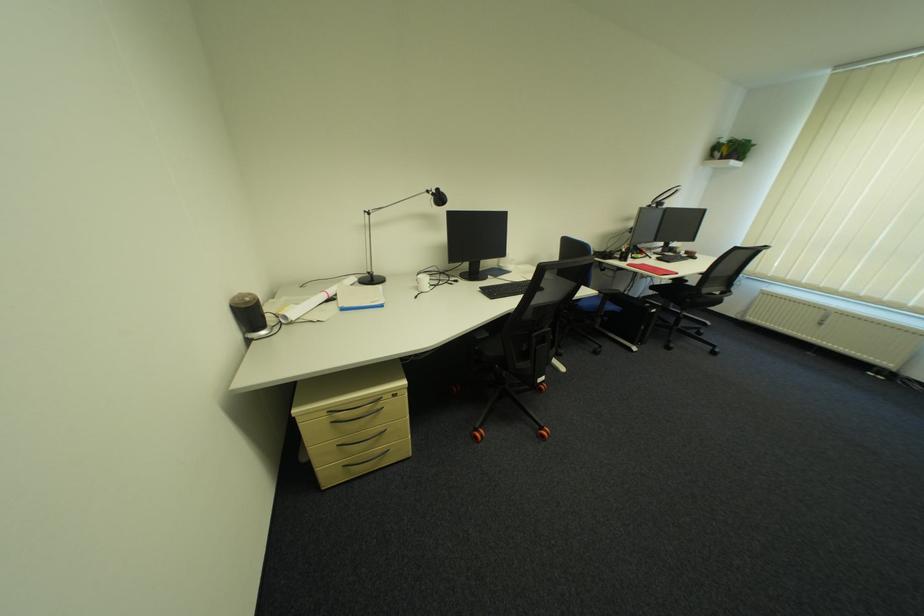
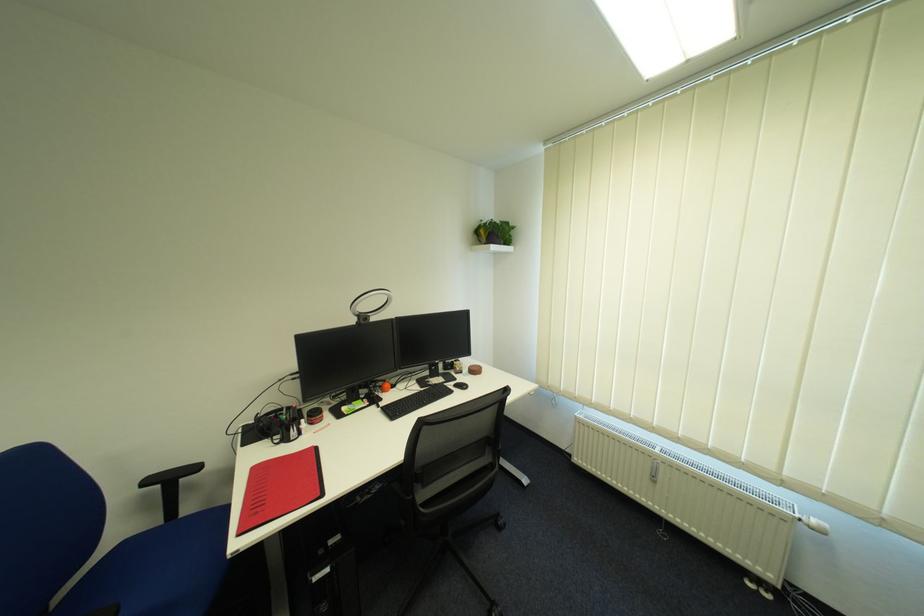
Where in the second image is the point corresponding to pixel 832 325 from the first image?

(664, 483)